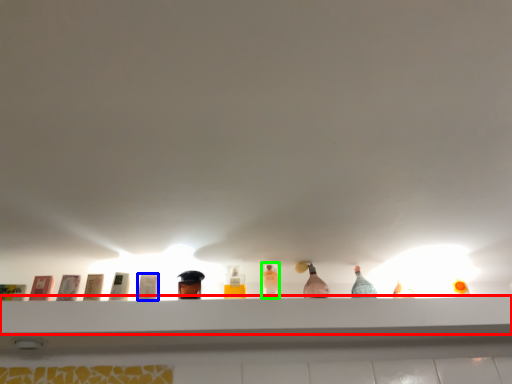
Question: Which is nearer to the shelf (highlighted by a red box)? toiletry (highlighted by a blue box) or bottle (highlighted by a green box).

Choices:
 (A) toiletry
 (B) bottle

Answer: (B)